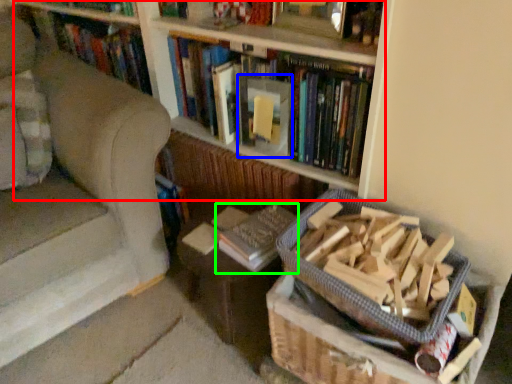
Question: Considering the real-world distances, which object is farthest from bookcase (highlighted by a red box)? paperback book (highlighted by a blue box) or book (highlighted by a green box)?

Choices:
 (A) paperback book
 (B) book

Answer: (B)